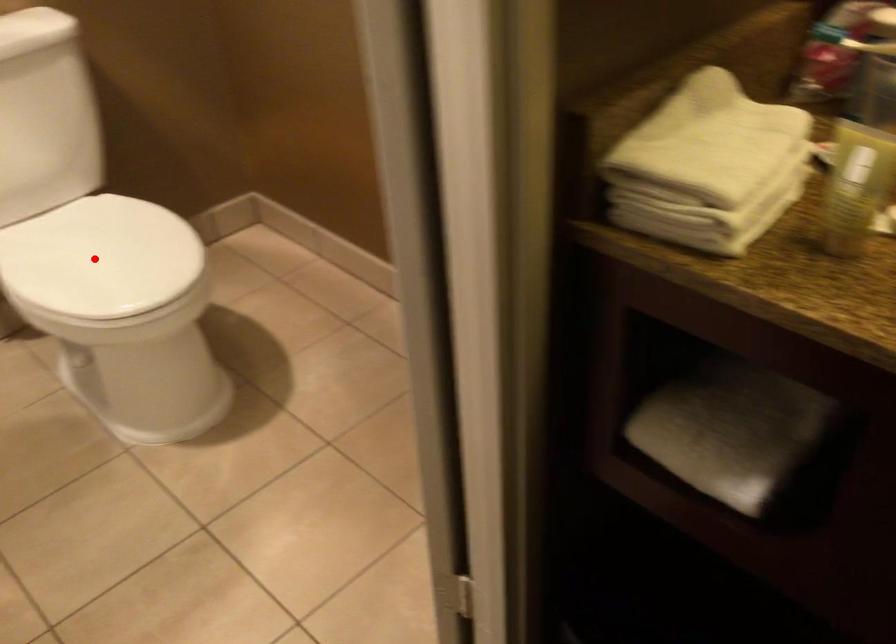
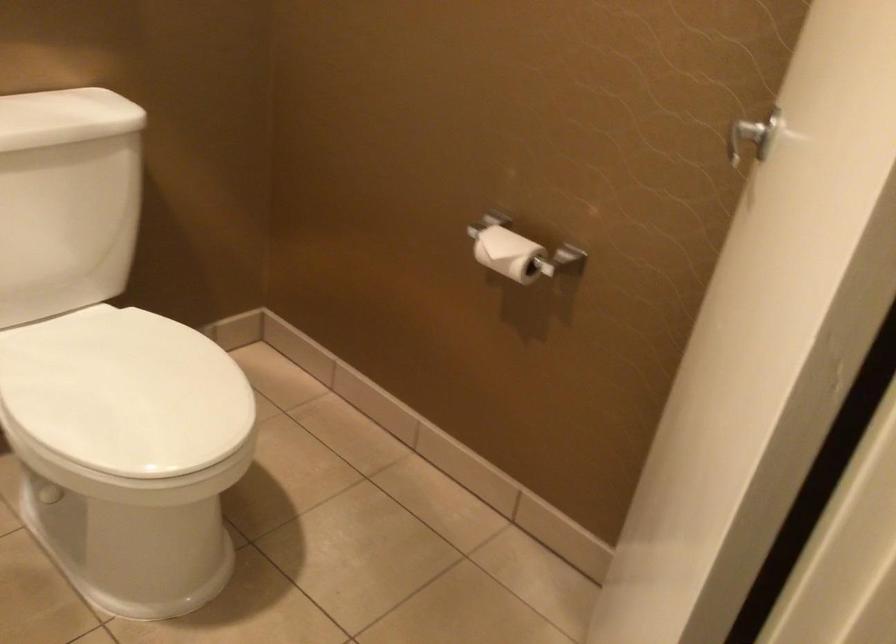
Question: I am providing you with two images of the same scene from different viewpoints. Image1 has a red point marked. In image2, the corresponding 3D location appears at what relative position? Reply with the corresponding letter.

Choices:
 (A) Closer
 (B) Farther

Answer: (A)